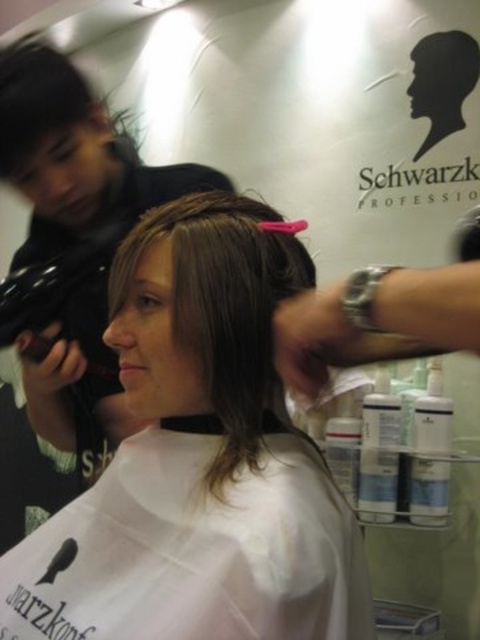
Is smooth brown hair at center taller than pink plastic comb at upper center?

Indeed, smooth brown hair at center has a greater height compared to pink plastic comb at upper center.

Consider the image. Which is more to the left, smooth brown hair at center or pink plastic comb at upper center?

Positioned to the left is smooth brown hair at center.

Identify the location of smooth brown hair at center. (199, 460).

Does smooth brown hair at center lie behind brown matte hair clip at center?

No, smooth brown hair at center is in front of brown matte hair clip at center.

Can you confirm if smooth brown hair at center is shorter than brown matte hair clip at center?

Incorrect, smooth brown hair at center's height does not fall short of brown matte hair clip at center's.

The height and width of the screenshot is (640, 480). In order to click on smooth brown hair at center in this screenshot , I will do 199,460.

Between brown matte hair clip at center and pink plastic comb at upper center, which one appears on the left side from the viewer's perspective?

brown matte hair clip at center

What do you see at coordinates (224, 305) in the screenshot? I see `brown matte hair clip at center` at bounding box center [224, 305].

Is point (277, 244) less distant than point (478, 285)?

No.

This screenshot has width=480, height=640. In order to click on brown matte hair clip at center in this screenshot , I will do `click(224, 305)`.